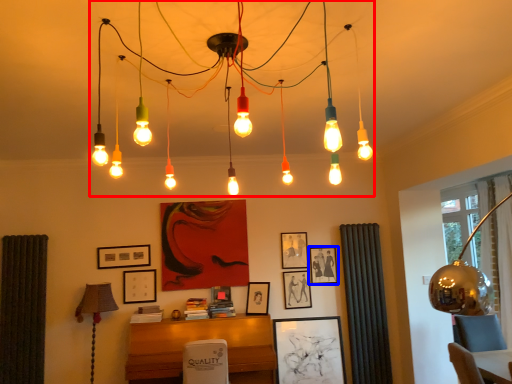
Question: Which of the following is the farthest to the observer, chandelier (highlighted by a red box) or picture frame (highlighted by a blue box)?

Choices:
 (A) chandelier
 (B) picture frame

Answer: (B)